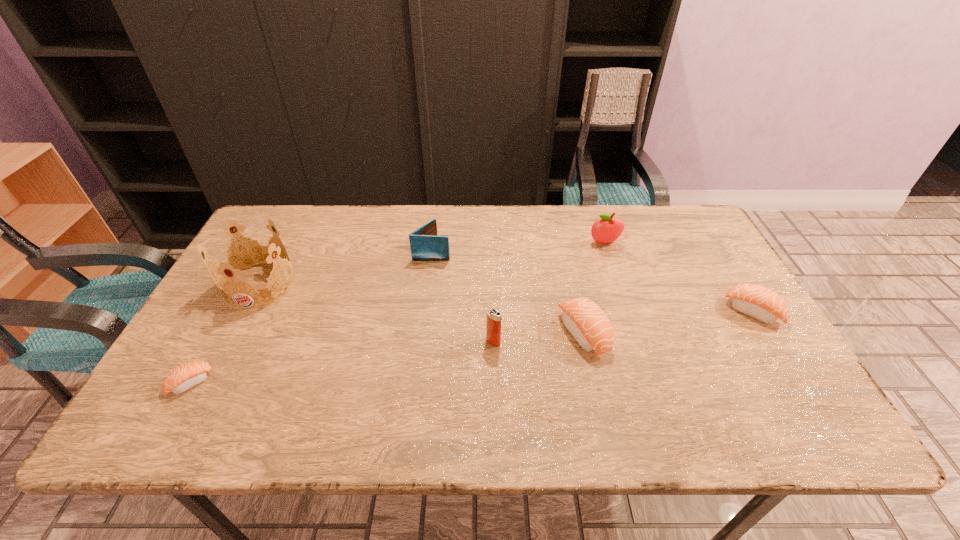
I want to click on the shortest object, so click(x=184, y=377).

You are a GUI agent. You are given a task and a screenshot of the screen. Output one action in this format:
    pyautogui.click(x=<x>, y=<y>)
    Task: Click on the nearest object
    This screenshot has height=540, width=960.
    Given the screenshot: What is the action you would take?
    pyautogui.click(x=184, y=377)

You are a GUI agent. You are given a task and a screenshot of the screen. Output one action in this format:
    pyautogui.click(x=<x>, y=<y>)
    Task: Click on the fifth object from left to right
    
    Given the screenshot: What is the action you would take?
    pyautogui.click(x=587, y=323)

Identify the location of the second tallest sushi. (758, 302).

Locate an element on the screen. the sixth tallest object is located at coordinates (758, 302).

What are the coordinates of `apple` in the screenshot? It's located at (607, 229).

Locate an element on the screen. The image size is (960, 540). the fourth tallest object is located at coordinates (425, 245).

Where is `the third object from left to right`? This screenshot has width=960, height=540. the third object from left to right is located at coordinates (425, 245).

At what (x,y) coordinates should I click in order to perform the action: click on the fourth object from left to right. Please return your answer as a coordinate pair (x, y). The height and width of the screenshot is (540, 960). Looking at the image, I should click on (494, 317).

I want to click on crown, so click(x=246, y=257).